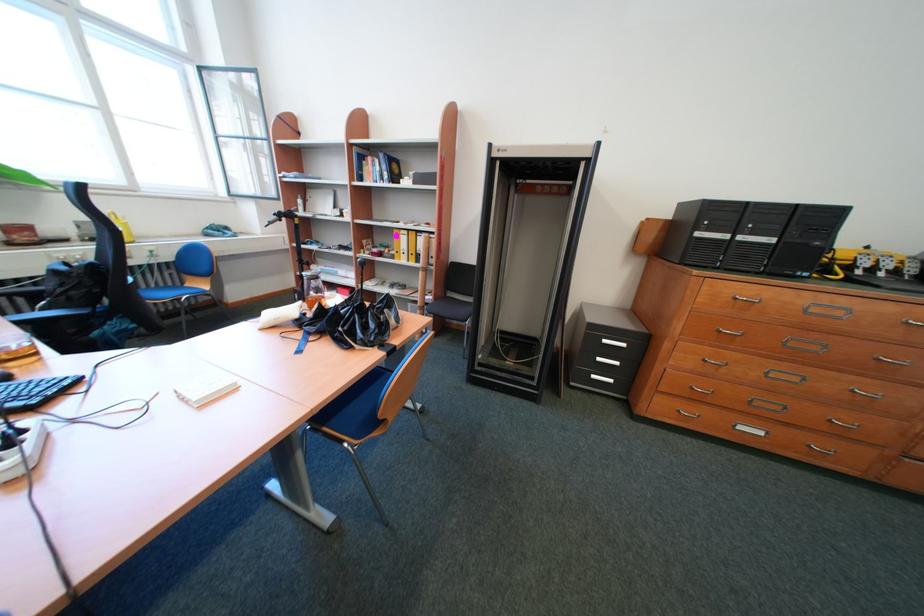
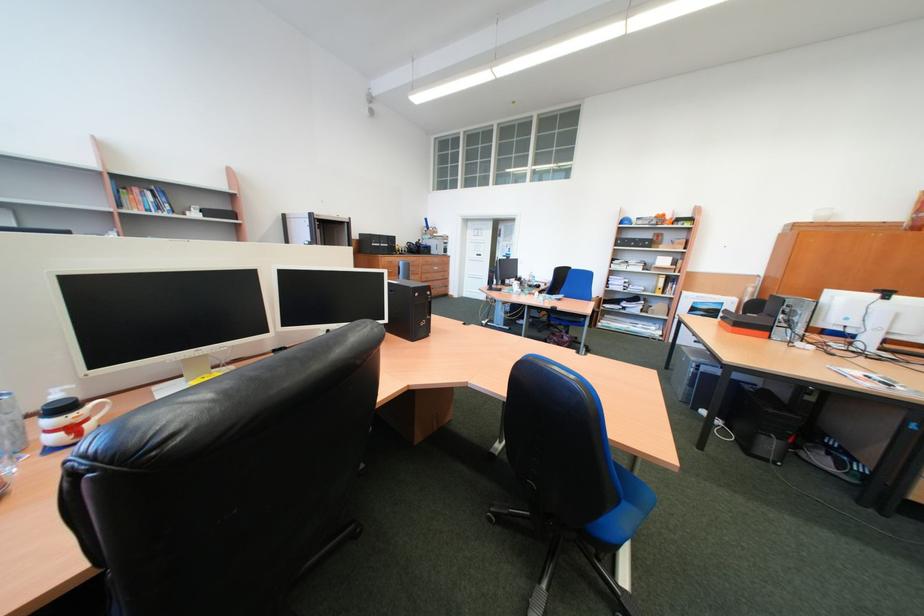
The point at [373,180] is marked in the first image. Where is the corresponding point in the second image?

(134, 207)